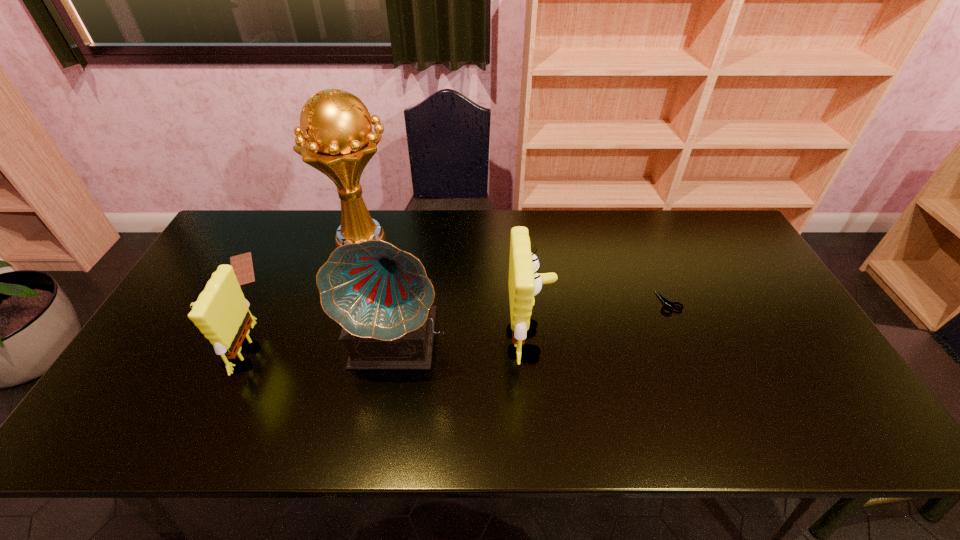
At what (x,y) coordinates should I click in order to perform the action: click on vacant area located on the face of the left sponge. Please return your answer as a coordinate pair (x, y). The width and height of the screenshot is (960, 540). Looking at the image, I should click on (172, 355).

The image size is (960, 540). Find the location of `blank area located 0.080m on the face of the left sponge`. blank area located 0.080m on the face of the left sponge is located at coordinates (192, 355).

Where is `free space located on the face of the left sponge`? free space located on the face of the left sponge is located at coordinates (145, 355).

Locate an element on the screen. The image size is (960, 540). vacant space located 0.250m on the face of the taller sponge is located at coordinates (641, 341).

This screenshot has width=960, height=540. I want to click on free space located at the front of the trophy_cup where the globe is prominent, so click(x=487, y=239).

The height and width of the screenshot is (540, 960). In order to click on vacant space located on the back of the shortest object in this screenshot , I will do `click(259, 239)`.

What are the coordinates of `vacant area situated on the horn of the record player` in the screenshot? It's located at (390, 400).

Where is `vacant area situated 0.120m on the left of the shears`? The width and height of the screenshot is (960, 540). vacant area situated 0.120m on the left of the shears is located at coordinates (615, 302).

You are a GUI agent. You are given a task and a screenshot of the screen. Output one action in this format:
    pyautogui.click(x=<x>, y=<y>)
    Task: Click on the trophy_cup that is at the far edge
    The width and height of the screenshot is (960, 540).
    Given the screenshot: What is the action you would take?
    pyautogui.click(x=335, y=136)

Locate an element on the screen. The image size is (960, 540). chocolate bar that is at the far edge is located at coordinates (242, 264).